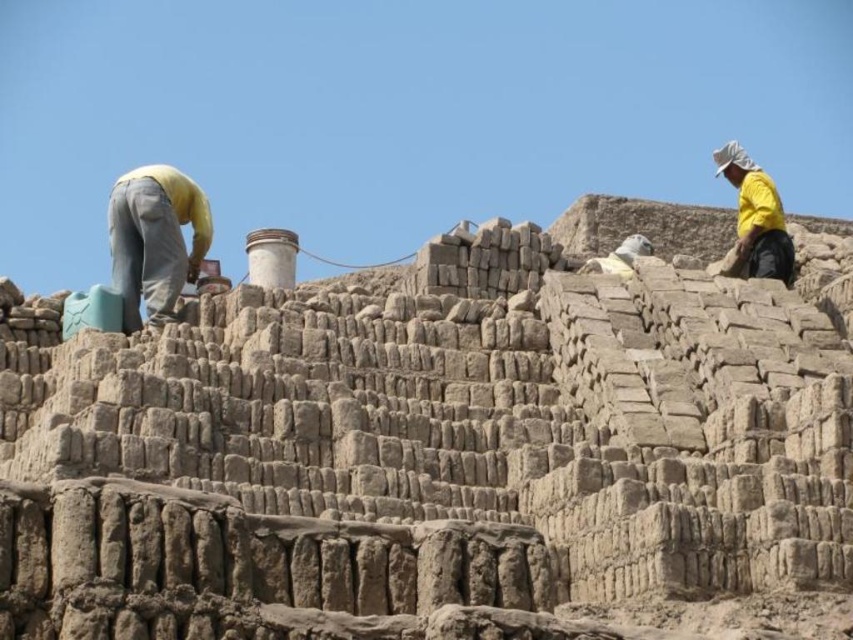
You are a photographer standing at the edge of the archaeological site. You want to take a photo that includes both the yellow fabric at center and the yellow matte shirt at upper right. Which object will appear larger in the photo?

The yellow fabric at center will appear larger in the photo because it is closer to the viewer than the yellow matte shirt at upper right.